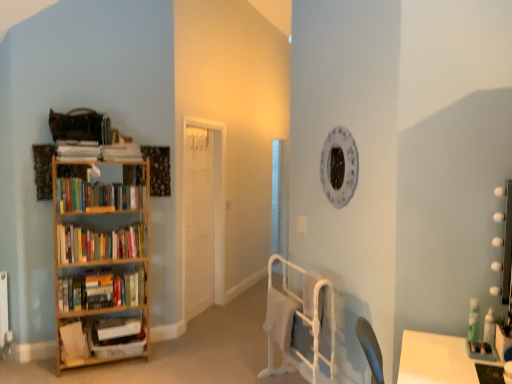
Question: Could white matte door at center be considered to be inside green plastic bottle at right?

Choices:
 (A) no
 (B) yes

Answer: (A)

Question: Is green plastic bottle at right positioned in front of white matte door at center?

Choices:
 (A) no
 (B) yes

Answer: (B)

Question: Is green plastic bottle at right aimed at white matte door at center?

Choices:
 (A) yes
 (B) no

Answer: (B)

Question: Is green plastic bottle at right wider than white matte door at center?

Choices:
 (A) yes
 (B) no

Answer: (A)

Question: From a real-world perspective, is green plastic bottle at right under white matte door at center?

Choices:
 (A) yes
 (B) no

Answer: (A)

Question: Is green plastic bottle at right to the right of white matte door at center from the viewer's perspective?

Choices:
 (A) no
 (B) yes

Answer: (B)

Question: Considering the relative sizes of white matte door at center and white matte bookshelf at left, which ranks as the 2th book in bottom-to-top order, in the image provided, is white matte door at center taller than white matte bookshelf at left, which ranks as the 2th book in bottom-to-top order,?

Choices:
 (A) no
 (B) yes

Answer: (B)

Question: Can you confirm if white matte door at center is thinner than white matte bookshelf at left, which ranks as the 2th book in bottom-to-top order?

Choices:
 (A) no
 (B) yes

Answer: (B)

Question: Is white matte door at center looking in the opposite direction of white matte bookshelf at left, which ranks as the 2th book in bottom-to-top order?

Choices:
 (A) yes
 (B) no

Answer: (B)

Question: From the image's perspective, is white matte door at center below white matte bookshelf at left, which ranks as the 2th book in bottom-to-top order?

Choices:
 (A) yes
 (B) no

Answer: (B)

Question: Is white matte bookshelf at left, which ranks as the 2th book in bottom-to-top order, a part of white matte door at center?

Choices:
 (A) yes
 (B) no

Answer: (B)

Question: Is white matte door at center completely or partially outside of white matte bookshelf at left, marked as the fourth book in a top-to-bottom arrangement?

Choices:
 (A) no
 (B) yes

Answer: (B)

Question: Is wooden bookshelf at left in front of hardcover books at left, which is counted as the 5th book, starting from the bottom?

Choices:
 (A) yes
 (B) no

Answer: (A)